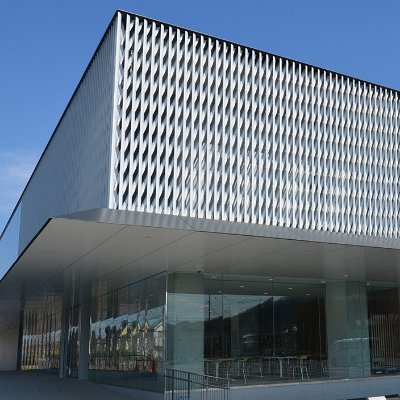
The height and width of the screenshot is (400, 400). Find the location of `floor`. floor is located at coordinates (67, 394).